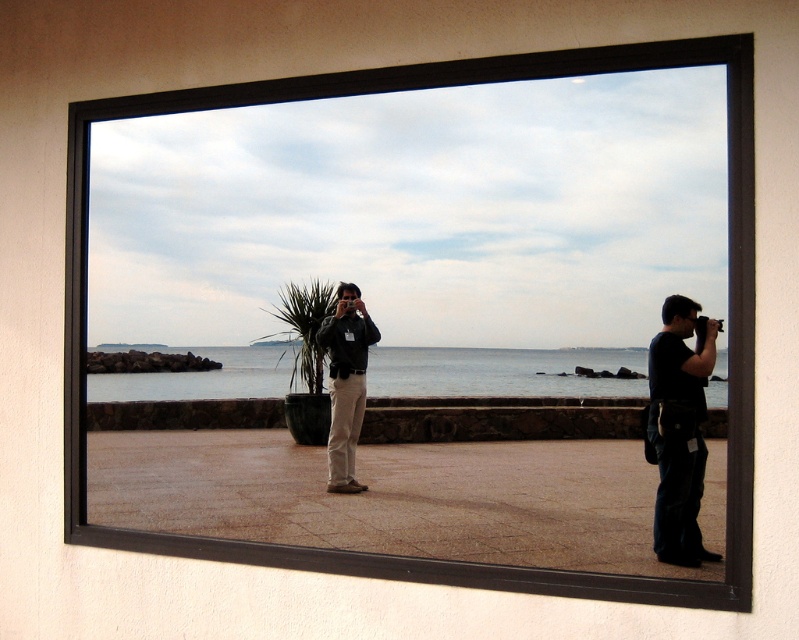
Question: Which of the following is the closest to the observer?

Choices:
 (A) matte black jacket at center
 (B) blue water at center

Answer: (B)

Question: Which point is closer to the camera taking this photo?

Choices:
 (A) (650, 360)
 (B) (240, 387)

Answer: (A)

Question: Does blue water at center have a larger size compared to black matte camera at right?

Choices:
 (A) yes
 (B) no

Answer: (A)

Question: Which object is the closest to the black matte camera at right?

Choices:
 (A) matte black jacket at center
 (B) blue water at center

Answer: (B)

Question: Does black matte camera at right have a greater width compared to matte black jacket at center?

Choices:
 (A) yes
 (B) no

Answer: (B)

Question: Is blue water at center further to the viewer compared to matte black jacket at center?

Choices:
 (A) yes
 (B) no

Answer: (B)